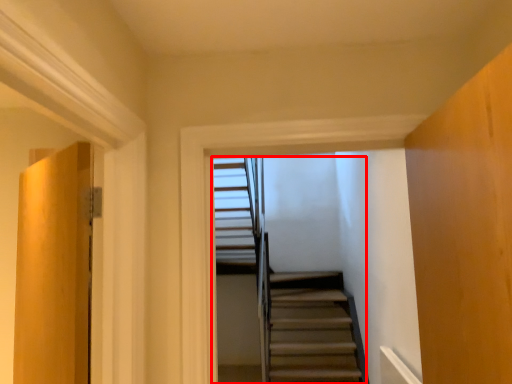
Question: Considering the relative positions of stairs (annotated by the red box) and door in the image provided, where is stairs (annotated by the red box) located with respect to the staircase?

Choices:
 (A) right
 (B) left

Answer: (A)